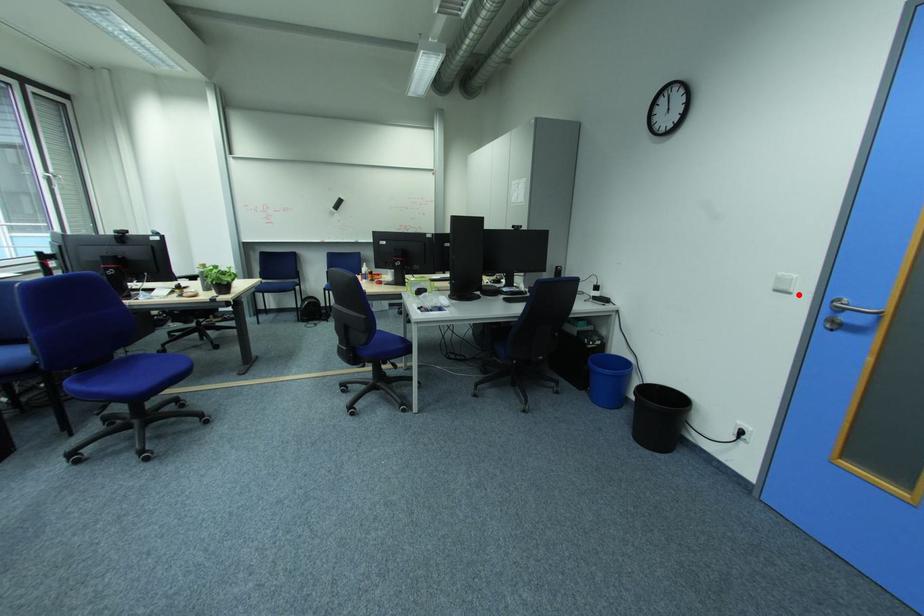
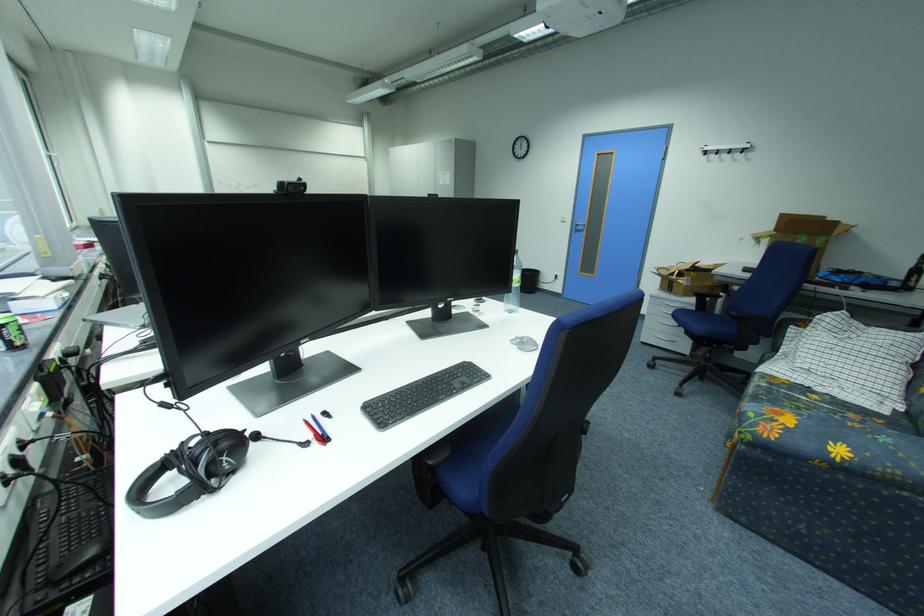
Locate, in the second image, the point that corresponds to the highlighted location in the first image.

(574, 223)